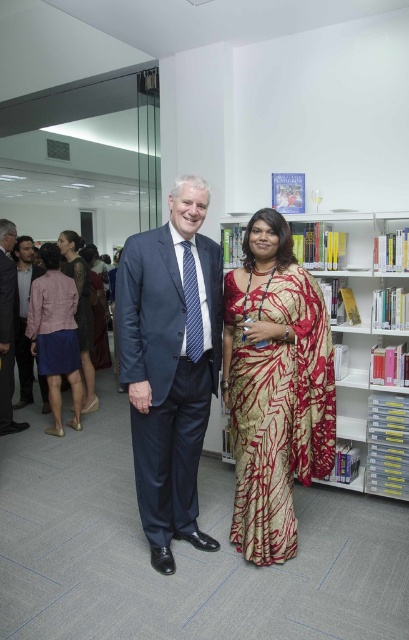
Question: Which object is farther from the camera taking this photo?

Choices:
 (A) metallic silver bookcase at upper right
 (B) matte pink dress at left
 (C) dark blue suit at left
 (D) pink fabric skirt at lower left

Answer: (D)

Question: Is matte pink dress at center thinner than velvet brown dress at center?

Choices:
 (A) yes
 (B) no

Answer: (A)

Question: Based on their relative distances, which object is nearer to the matte pink dress at center?

Choices:
 (A) dark blue suit at center
 (B) matte pink dress at left
 (C) metallic silver bookcase at upper right
 (D) gold silk saree at center

Answer: (B)

Question: Which object is closer to the camera taking this photo?

Choices:
 (A) pink fabric skirt at lower left
 (B) matte pink dress at center

Answer: (A)

Question: From the image, what is the correct spatial relationship of pink fabric skirt at lower left in relation to dark gray suit at left?

Choices:
 (A) left
 (B) right

Answer: (B)

Question: Can you confirm if metallic silver bookcase at upper right is positioned above matte pink dress at center?

Choices:
 (A) yes
 (B) no

Answer: (B)